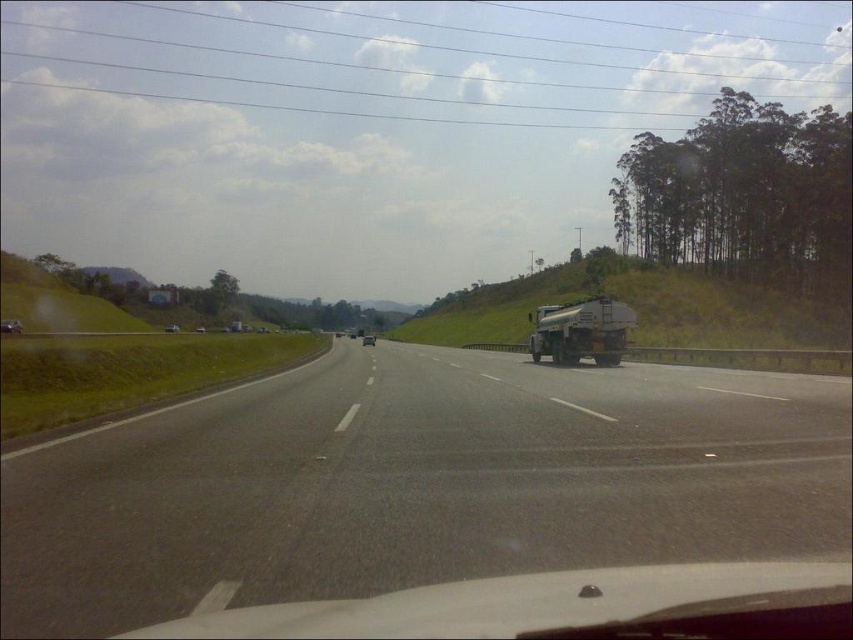
Consider the image. Can you confirm if green grassy hill at right is wider than metallic silver tanker at right?

Correct, the width of green grassy hill at right exceeds that of metallic silver tanker at right.

Is point (810, 301) positioned behind point (561, 355)?

Yes, point (810, 301) is farther from viewer.

You are a GUI agent. You are given a task and a screenshot of the screen. Output one action in this format:
    pyautogui.click(x=<x>, y=<y>)
    Task: Click on the green grassy hill at right
    The height and width of the screenshot is (640, 853).
    Given the screenshot: What is the action you would take?
    pyautogui.click(x=639, y=308)

What do you see at coordinates (581, 330) in the screenshot? I see `metallic silver tanker at right` at bounding box center [581, 330].

Does metallic silver tanker at right have a lesser width compared to shiny silver sedan at left?

Yes.

Is point (589, 314) closer to viewer compared to point (4, 330)?

Yes.

The height and width of the screenshot is (640, 853). Identify the location of metallic silver tanker at right. 581,330.

The width and height of the screenshot is (853, 640). Identify the location of black asphalt highway at center. (416, 483).

Who is more distant from viewer, (582, 545) or (4, 321)?

The point (4, 321) is more distant.

Locate an element on the screen. Image resolution: width=853 pixels, height=640 pixels. black asphalt highway at center is located at coordinates (416, 483).